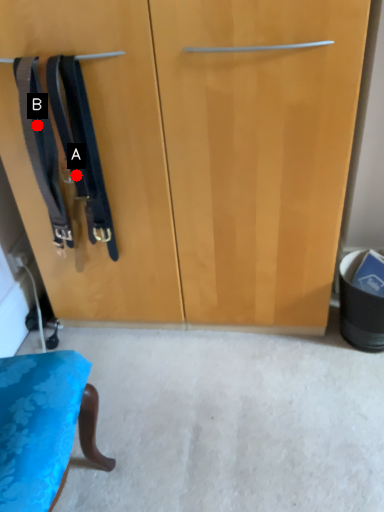
Question: Two points are circled on the image, labeled by A and B beside each circle. Which point is closer to the camera?

Choices:
 (A) A is closer
 (B) B is closer

Answer: (B)